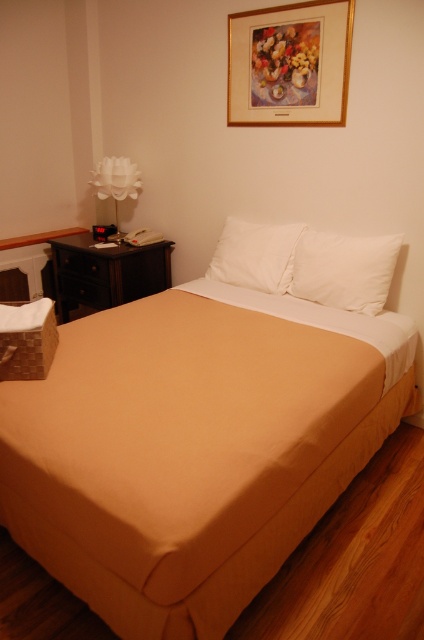
You are standing in the bedroom and want to grab the white fabric lamp at left from the white smooth pillow at upper right. Which object do you need to move first?

You need to move the white smooth pillow at upper right first because it is closer to you than the white fabric lamp at left, so it is blocking the path to the lamp.